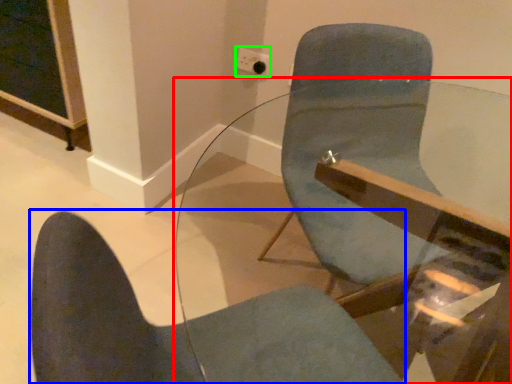
Question: Which is farther away from table (highlighted by a red box)? chair (highlighted by a blue box) or electric outlet (highlighted by a green box)?

Choices:
 (A) chair
 (B) electric outlet

Answer: (B)